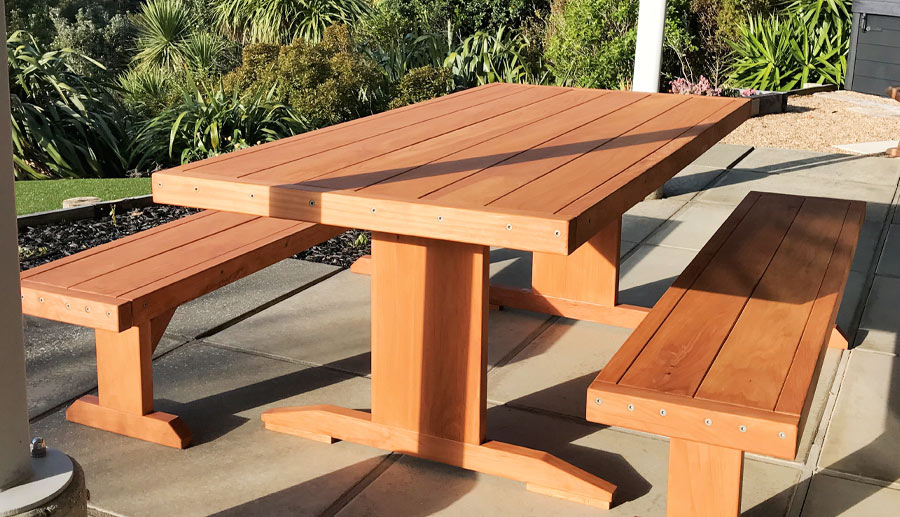
In order to click on table legs in this screenshot , I will do `click(415, 334)`, `click(576, 267)`.